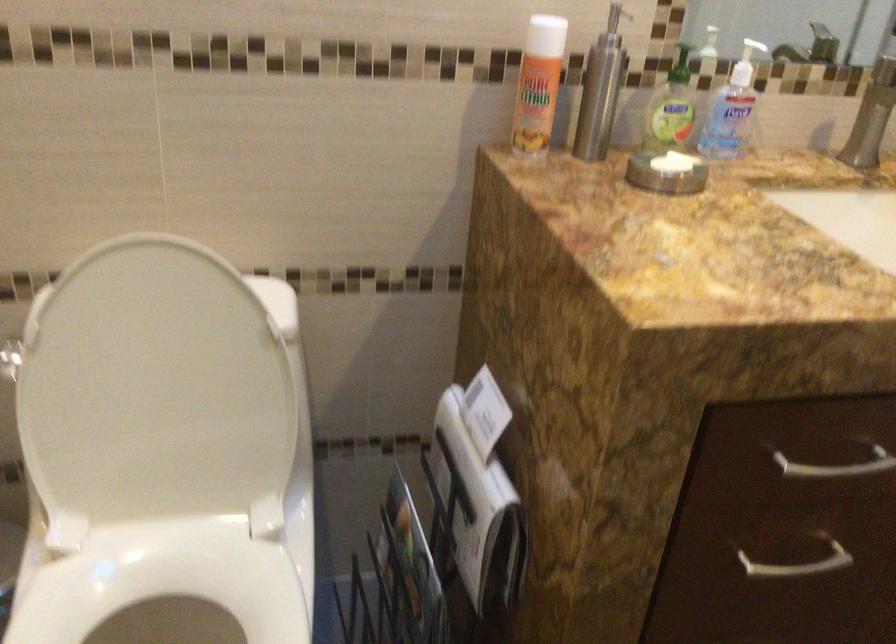
The width and height of the screenshot is (896, 644). I want to click on green dispenser pump, so tap(679, 66).